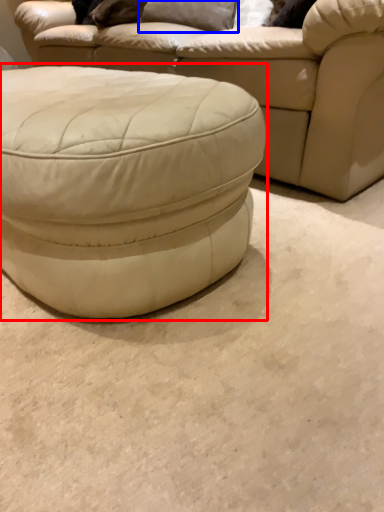
Question: Which of the following is the closest to the observer, stool (highlighted by a red box) or pillow (highlighted by a blue box)?

Choices:
 (A) stool
 (B) pillow

Answer: (A)